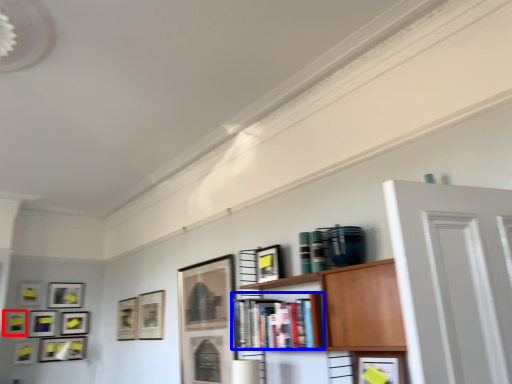
Question: Among these objects, which one is nearest to the camera, picture frame (highlighted by a red box) or book (highlighted by a blue box)?

Choices:
 (A) picture frame
 (B) book

Answer: (B)